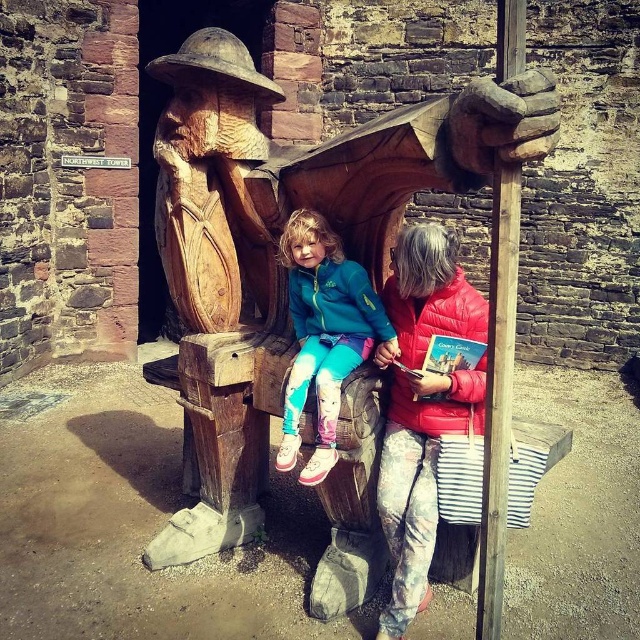
Does point (369, 378) come closer to viewer compared to point (280, 452)?

That is False.

Who is more forward, (179, 353) or (328, 440)?

Point (328, 440) is in front.

Is point (256, 298) in front of point (280, 442)?

Yes, it is in front of point (280, 442).

Locate an element on the screen. The width and height of the screenshot is (640, 640). natural wood bench at center is located at coordinates (275, 248).